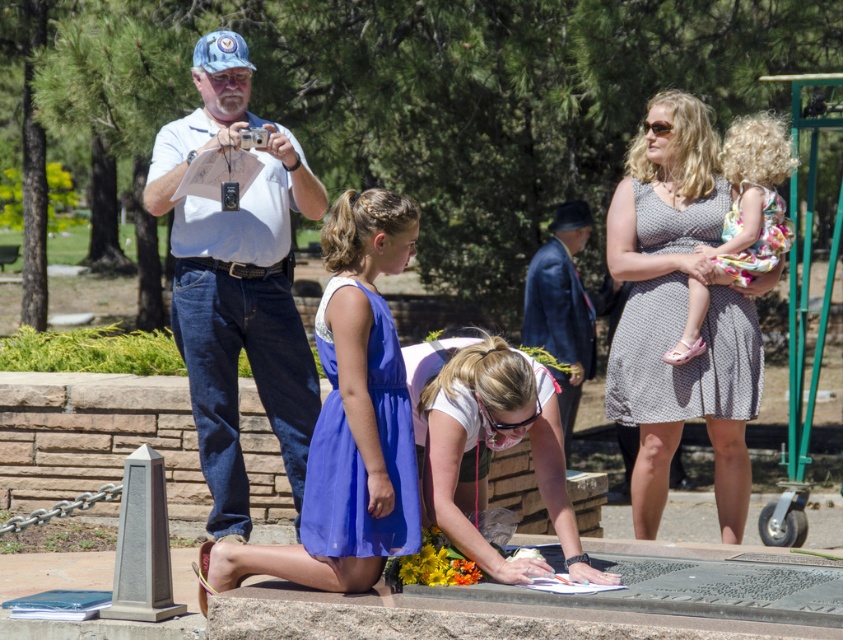
Can you confirm if white cotton dress at center is taller than gray dotted dress at center?

Indeed, white cotton dress at center has a greater height compared to gray dotted dress at center.

Is point (192, 241) closer to camera compared to point (713, 198)?

Yes, it is in front of point (713, 198).

Locate an element on the screen. This screenshot has width=843, height=640. white cotton dress at center is located at coordinates (694, 394).

Does white cotton dress at center lie in front of floral fabric dress at upper right?

Yes, it is in front of floral fabric dress at upper right.

Who is higher up, white cotton dress at center or floral fabric dress at upper right?

white cotton dress at center is higher up.

Locate an element on the screen. The image size is (843, 640). white cotton dress at center is located at coordinates (694, 394).

What do you see at coordinates (680, 312) in the screenshot? Image resolution: width=843 pixels, height=640 pixels. I see `polka dot dress at upper right` at bounding box center [680, 312].

Which is behind, point (619, 384) or point (307, 502)?

The point (619, 384) is behind.

I want to click on polka dot dress at upper right, so 680,312.